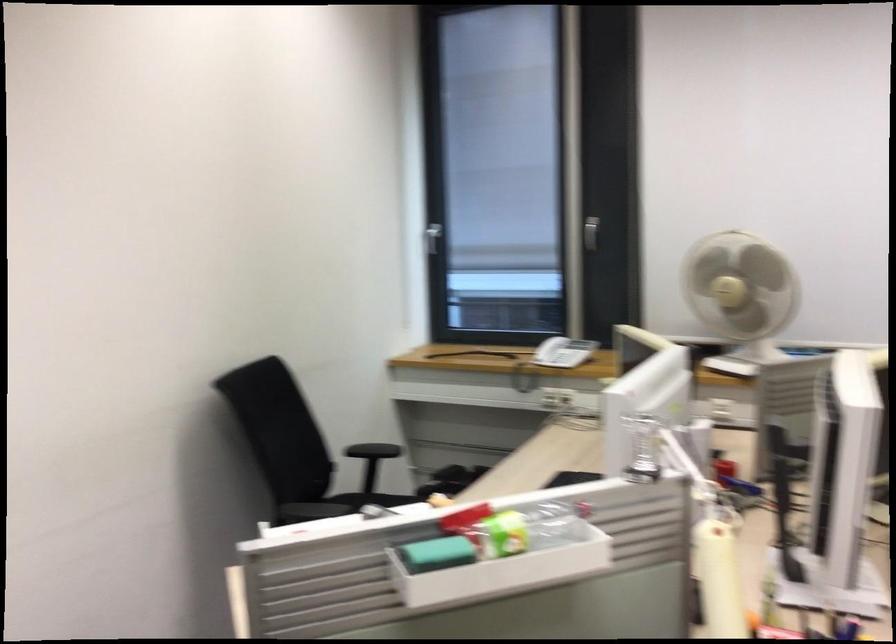
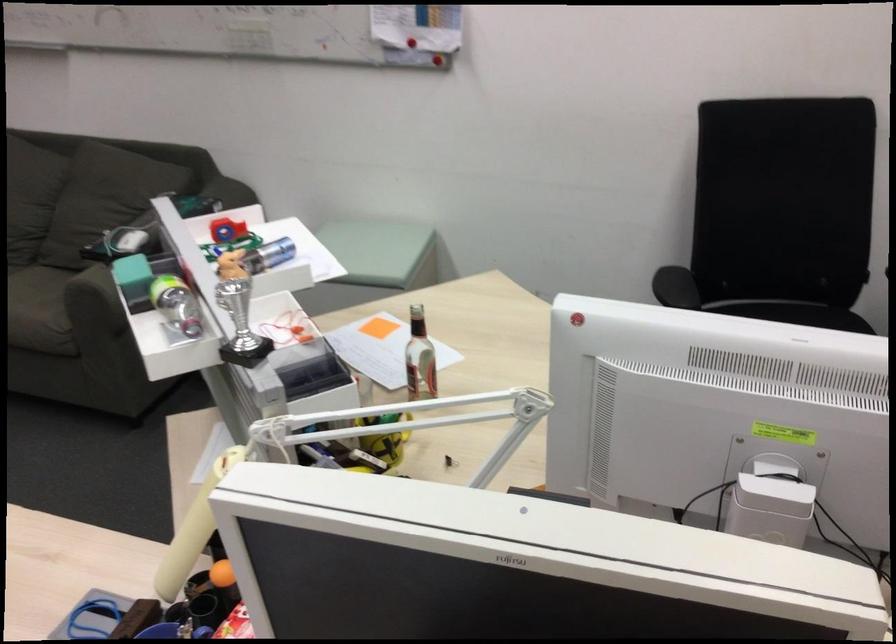
Find the pixel in the second image that matches the point at 446,556 in the first image.

(240, 324)